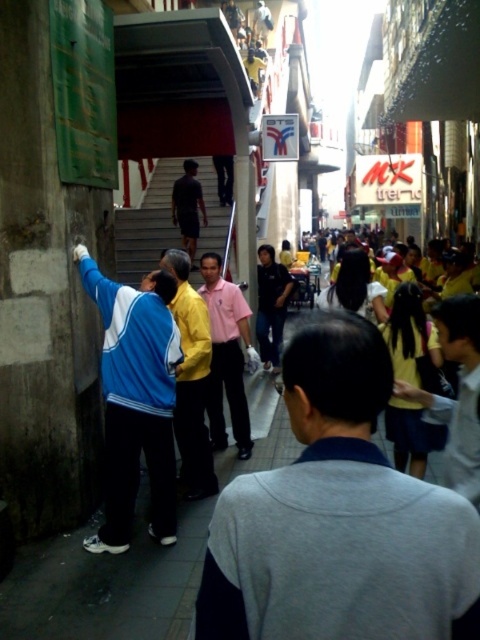
You are a photographer trying to capture a photo of the dark matte shirt at center without the blue fabric jacket at left overlapping it. Given their positions, is this possible?

The blue fabric jacket at left might be wider than dark matte shirt at center, so there is a possibility of overlap. Adjust your angle or position to ensure the blue fabric jacket at left doesn